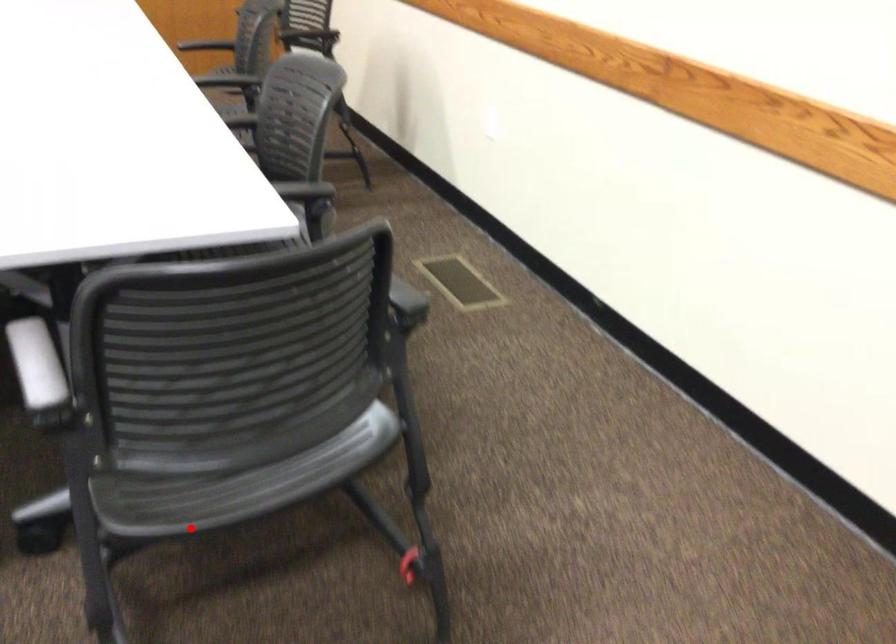
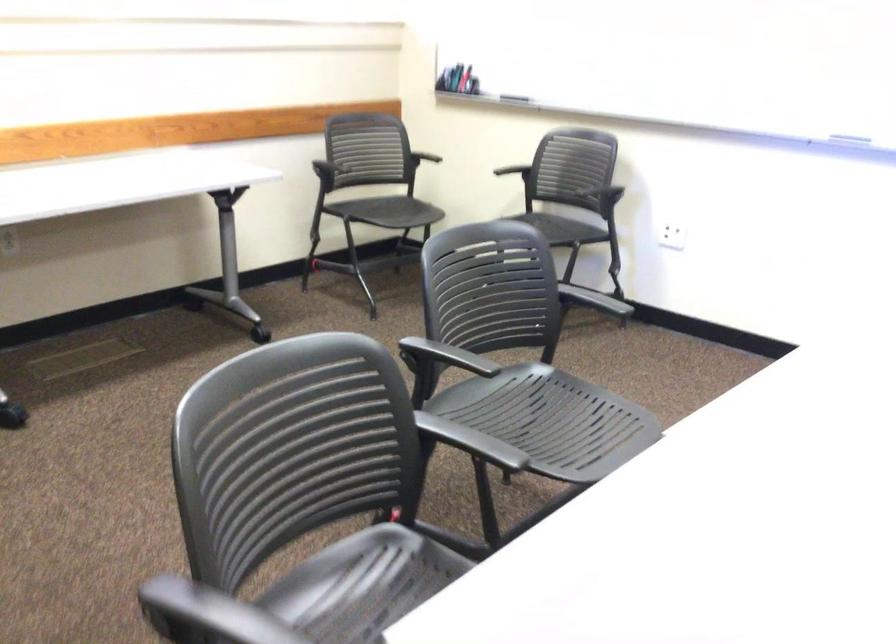
In the second image, find the point that corresponds to the highlighted location in the first image.

(362, 585)